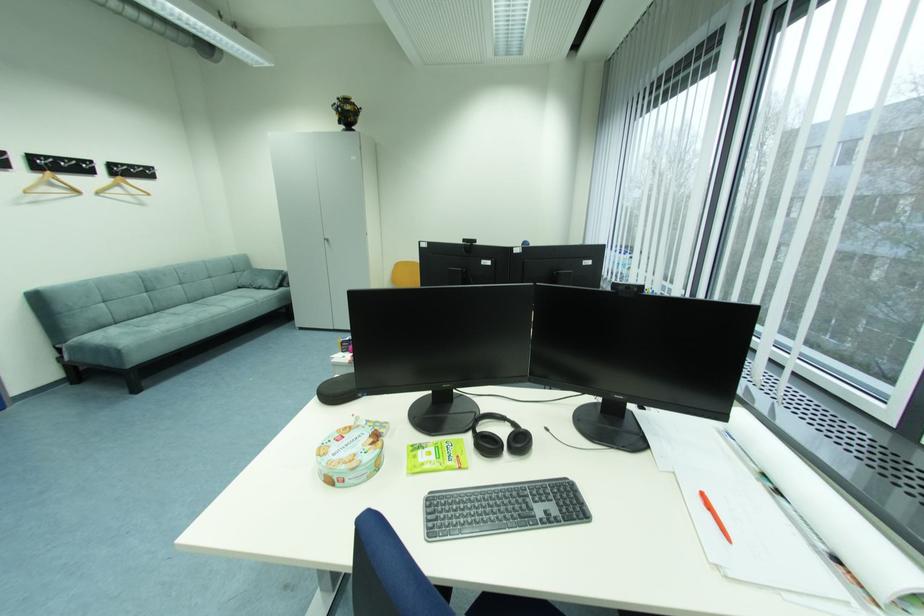
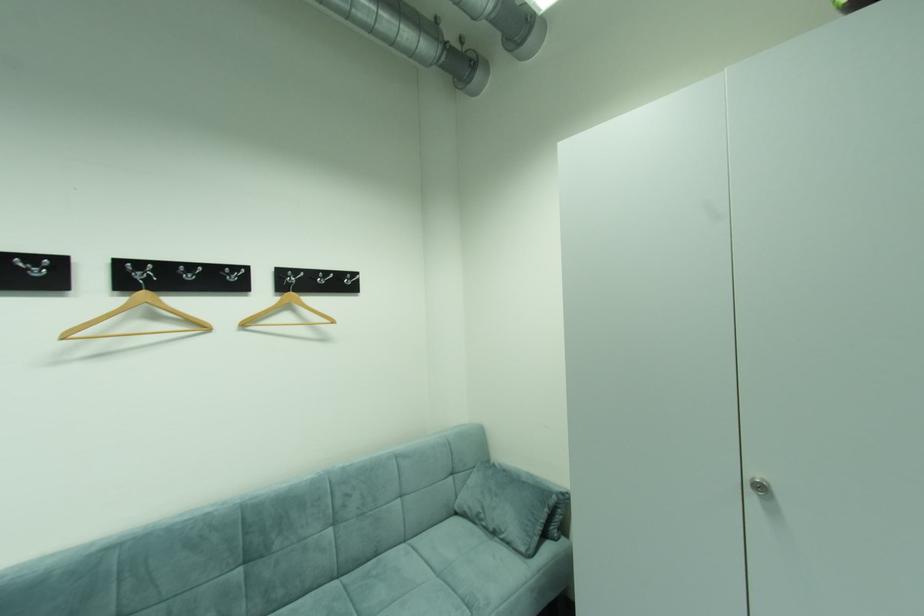
Find the pixel in the second image that matches point 55,174 in the first image.

(150, 294)